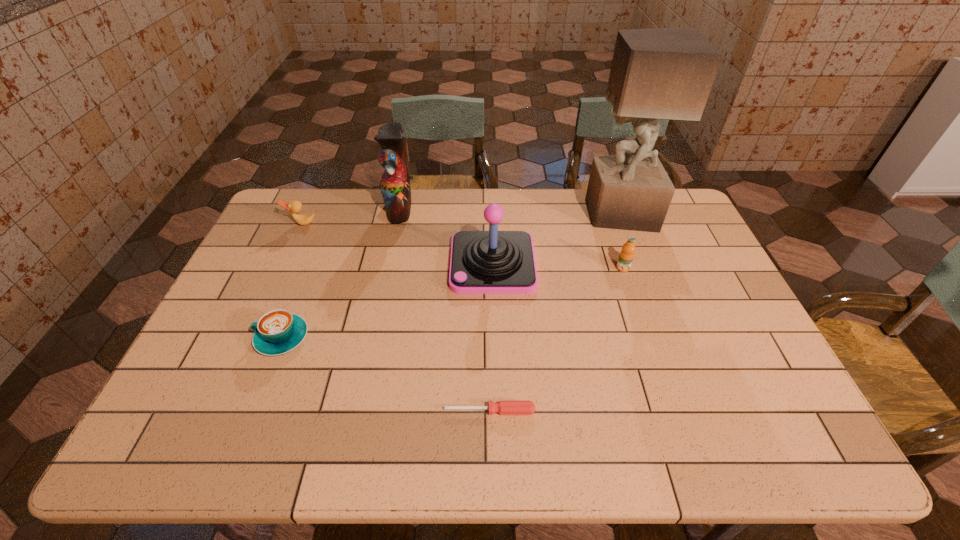
Find the location of `free spot at the far edge of the desktop`. free spot at the far edge of the desktop is located at coordinates (418, 198).

Find the location of `vacant space at the near edge of the desktop`. vacant space at the near edge of the desktop is located at coordinates (695, 451).

This screenshot has width=960, height=540. Find the location of `blank space at the left edge`. blank space at the left edge is located at coordinates (300, 233).

At what (x,y) coordinates should I click in order to perform the action: click on empty space that is in between the tallest object and the third tallest object. Please return your answer as a coordinate pair (x, y). The height and width of the screenshot is (540, 960). Looking at the image, I should click on (556, 238).

I want to click on vacant area between the joystick and the fifth tallest object, so click(397, 244).

Where is `vacant region between the tallest object and the fourth tallest object`? This screenshot has width=960, height=540. vacant region between the tallest object and the fourth tallest object is located at coordinates (620, 240).

The height and width of the screenshot is (540, 960). What are the coordinates of `free spot between the parrot and the second nearest object` in the screenshot? It's located at (341, 273).

Identify the location of free space that is in between the joystick and the second tallest object. The height and width of the screenshot is (540, 960). click(x=446, y=235).

I want to click on free space between the third tallest object and the sculpture, so click(556, 238).

This screenshot has height=540, width=960. Identify the location of free area in between the fourth shortest object and the fifth shortest object. (558, 266).